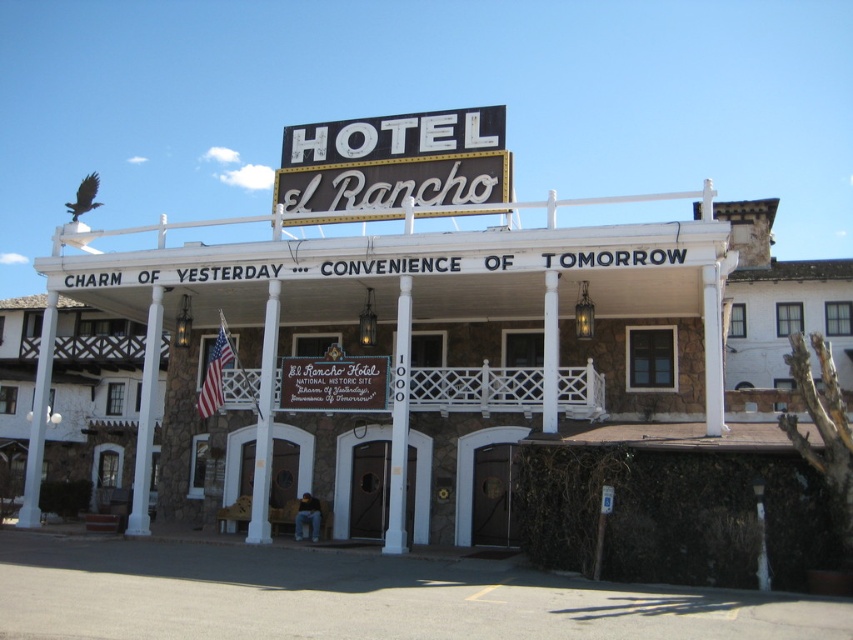
Can you confirm if brown wooden sign at center is positioned below white stone pillar at center?

No.

Is brown wooden sign at center wider than white stone pillar at center?

No, brown wooden sign at center is not wider than white stone pillar at center.

Is point (294, 401) positioned in front of point (138, 436)?

Yes, point (294, 401) is closer to viewer.

Where is `brown wooden sign at center`? The image size is (853, 640). brown wooden sign at center is located at coordinates (334, 381).

Can you confirm if wooden beams at lower left is wider than white wood pillar at left?

Correct, the width of wooden beams at lower left exceeds that of white wood pillar at left.

Is wooden beams at lower left positioned in front of white wood pillar at left?

No.

Where is `wooden beams at lower left`? Image resolution: width=853 pixels, height=640 pixels. wooden beams at lower left is located at coordinates (93, 396).

Can you confirm if metallic gold sign at center is positioned above brown wooden sign at center?

Yes, metallic gold sign at center is above brown wooden sign at center.

Who is higher up, metallic gold sign at center or brown wooden sign at center?

Positioned higher is metallic gold sign at center.

Which is behind, point (318, 208) or point (331, 394)?

The point (318, 208) is behind.

This screenshot has width=853, height=640. Find the location of `metallic gold sign at center`. metallic gold sign at center is located at coordinates (395, 161).